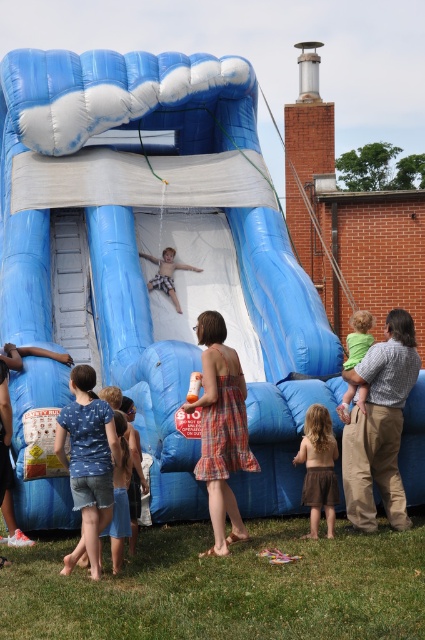
Question: Which of these objects is positioned closest to the matte black shorts at lower left?

Choices:
 (A) green fabric at center
 (B) plaid dress at center

Answer: (B)

Question: Based on their relative distances, which object is farther from the brown skirt at lower center?

Choices:
 (A) matte blue shorts at center
 (B) matte black shorts at lower left

Answer: (A)

Question: Does green fabric at center have a larger size compared to matte black shorts at lower left?

Choices:
 (A) no
 (B) yes

Answer: (B)

Question: Which of the following is the closest to the observer?

Choices:
 (A) matte black shorts at lower left
 (B) matte blue shorts at center
 (C) denim shorts at lower left
 (D) plaid dress at center

Answer: (C)

Question: Is denim shorts at lower left positioned behind brown skirt at lower center?

Choices:
 (A) yes
 (B) no

Answer: (B)

Question: Does denim shorts at lower left come behind brown skirt at lower center?

Choices:
 (A) yes
 (B) no

Answer: (B)